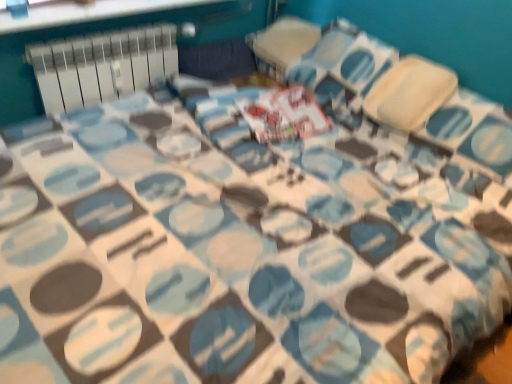
This screenshot has height=384, width=512. Find the location of `white plastic radiator at upper left`. white plastic radiator at upper left is located at coordinates (102, 65).

What do you see at coordinates (102, 65) in the screenshot?
I see `white plastic radiator at upper left` at bounding box center [102, 65].

In order to face white plastic radiator at upper left, should I rotate leftwards or rightwards?

It's best to rotate left around 17.174 degrees.

Identify the location of white plastic radiator at upper left. This screenshot has height=384, width=512. (102, 65).